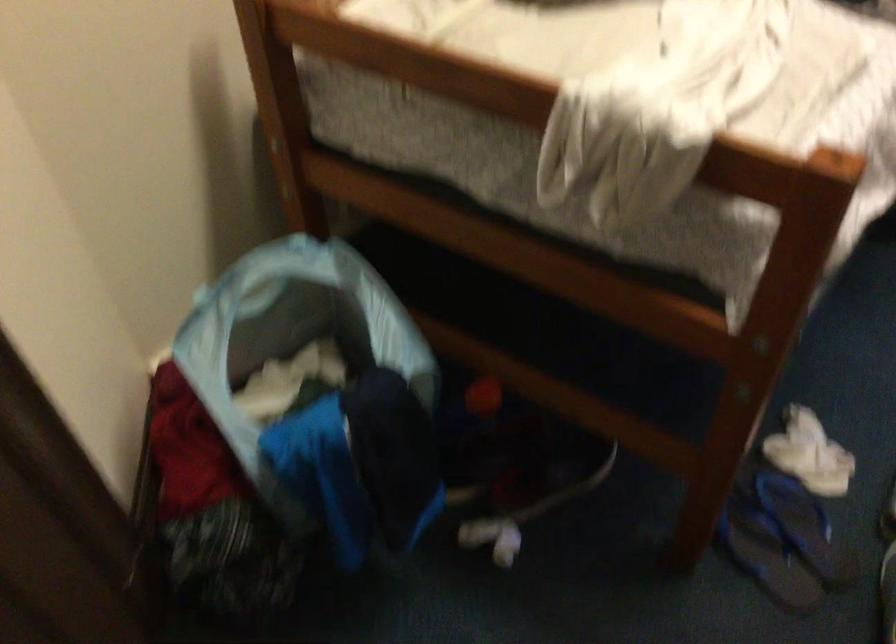
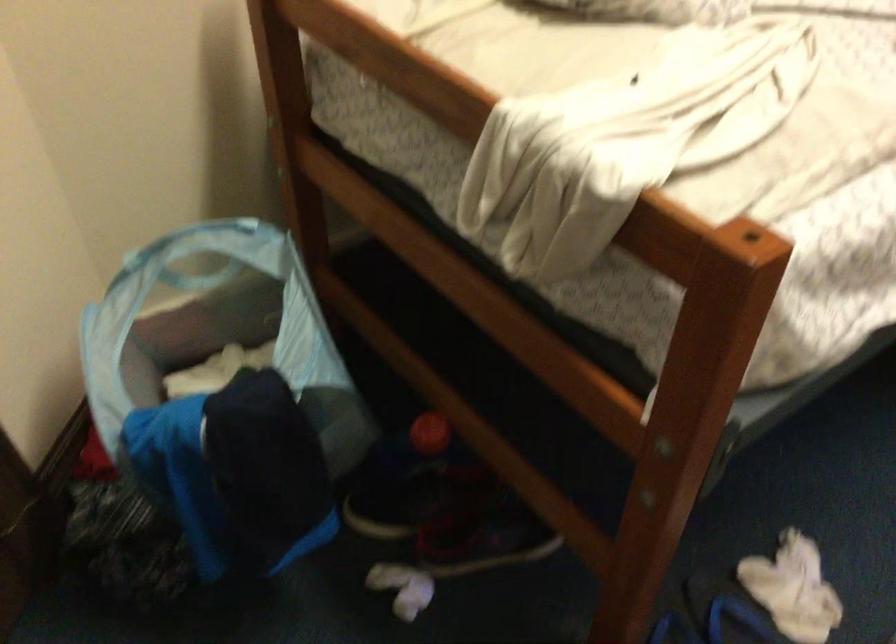
Question: The camera is either moving clockwise (left) or counter-clockwise (right) around the object. The first image is from the beginning of the video and the second image is from the end. Is the camera moving left or right when shooting the video?

Choices:
 (A) Left
 (B) Right

Answer: (B)